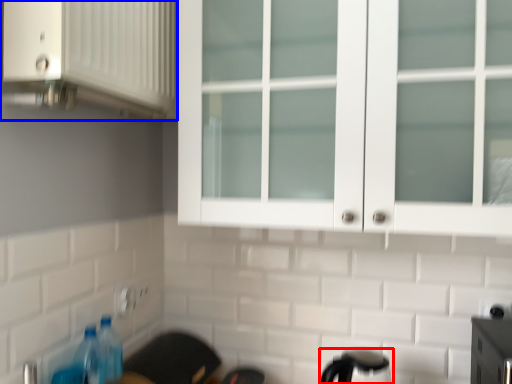
Question: Which point is closer to the camera, appliance (highlighted by a red box) or cabinetry (highlighted by a blue box)?

Choices:
 (A) appliance
 (B) cabinetry

Answer: (B)